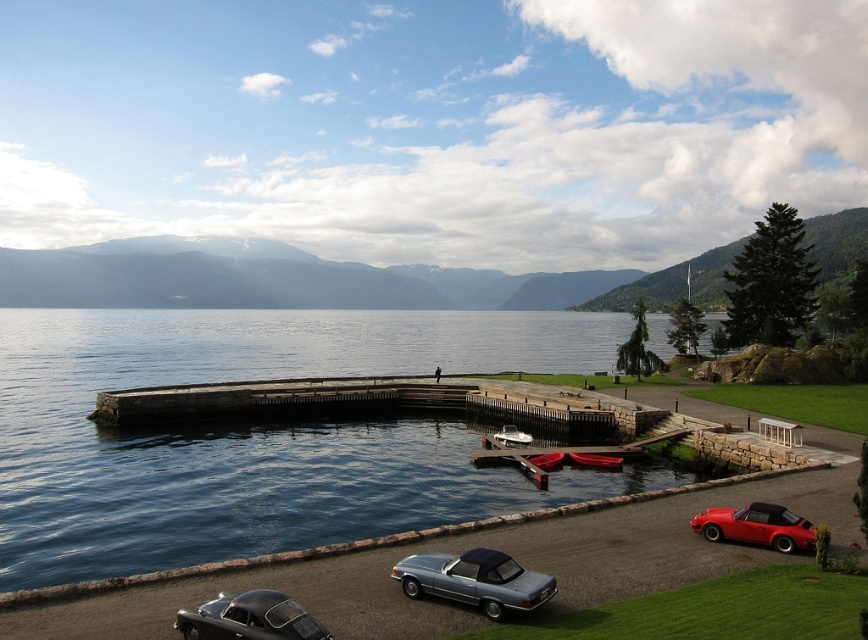
Is smooth concrete dock at center below white glossy boat at center?

Incorrect, smooth concrete dock at center is not positioned below white glossy boat at center.

Which is behind, point (119, 392) or point (482, 435)?

Point (119, 392)

Where is `smooth concrete dock at center`? smooth concrete dock at center is located at coordinates (370, 403).

Which is above, white glossy boat at center or wooden canoe at lower center?

white glossy boat at center

Between point (483, 436) and point (544, 465), which one is positioned behind?

The point (483, 436) is more distant.

Which is behind, point (504, 438) or point (531, 456)?

The point (504, 438) is behind.

You are a GUI agent. You are given a task and a screenshot of the screen. Output one action in this format:
    pyautogui.click(x=<x>, y=<y>)
    Task: Click on the white glossy boat at center
    
    Given the screenshot: What is the action you would take?
    pyautogui.click(x=508, y=436)

Does shiny black car at lower left appear over shiny red convertible at lower right?

Yes, shiny black car at lower left is above shiny red convertible at lower right.

Between shiny black car at lower left and shiny red convertible at lower right, which one appears on the right side from the viewer's perspective?

From the viewer's perspective, shiny red convertible at lower right appears more on the right side.

This screenshot has height=640, width=868. What are the coordinates of `shiny black car at lower left` in the screenshot? It's located at (248, 618).